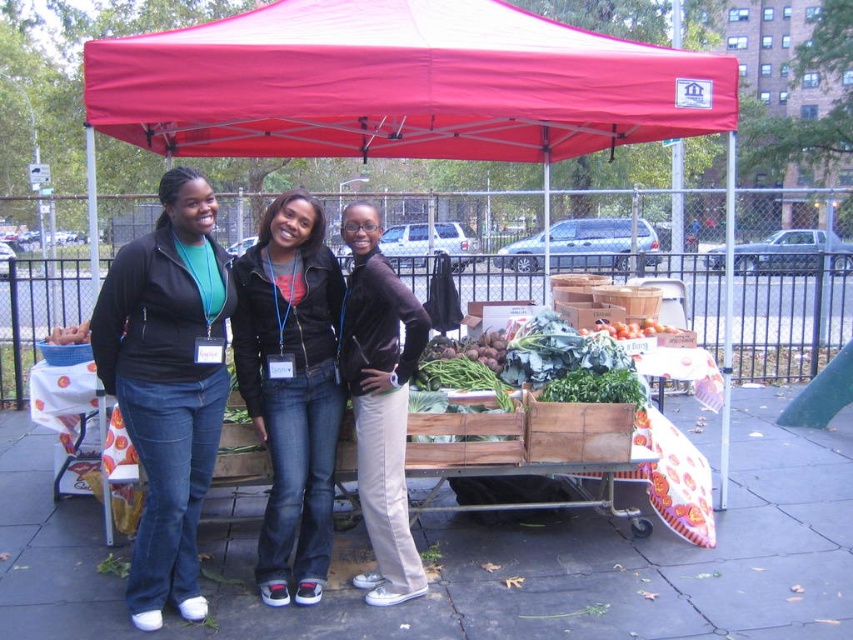
Is smooth concrete pavement at center to the left of matte red canopy at upper center from the viewer's perspective?

In fact, smooth concrete pavement at center is to the right of matte red canopy at upper center.

Does smooth concrete pavement at center come in front of matte red canopy at upper center?

Yes, it is in front of matte red canopy at upper center.

Image resolution: width=853 pixels, height=640 pixels. Identify the location of smooth concrete pavement at center. (486, 561).

Where is `smooth concrete pavement at center`? smooth concrete pavement at center is located at coordinates tap(486, 561).

Does brown suede jacket at center have a smaller size compared to ripe red tomatoes at center?

No.

Is point (386, 321) more distant than point (611, 328)?

No, (386, 321) is in front of (611, 328).

What do you see at coordinates (380, 403) in the screenshot? I see `brown suede jacket at center` at bounding box center [380, 403].

I want to click on brown suede jacket at center, so click(x=380, y=403).

Between smooth concrete pavement at center and denim jeans at center, which one appears on the right side from the viewer's perspective?

From the viewer's perspective, smooth concrete pavement at center appears more on the right side.

Between point (746, 394) and point (267, 508), which one is positioned behind?

The point (746, 394) is behind.

The height and width of the screenshot is (640, 853). I want to click on smooth concrete pavement at center, so click(x=486, y=561).